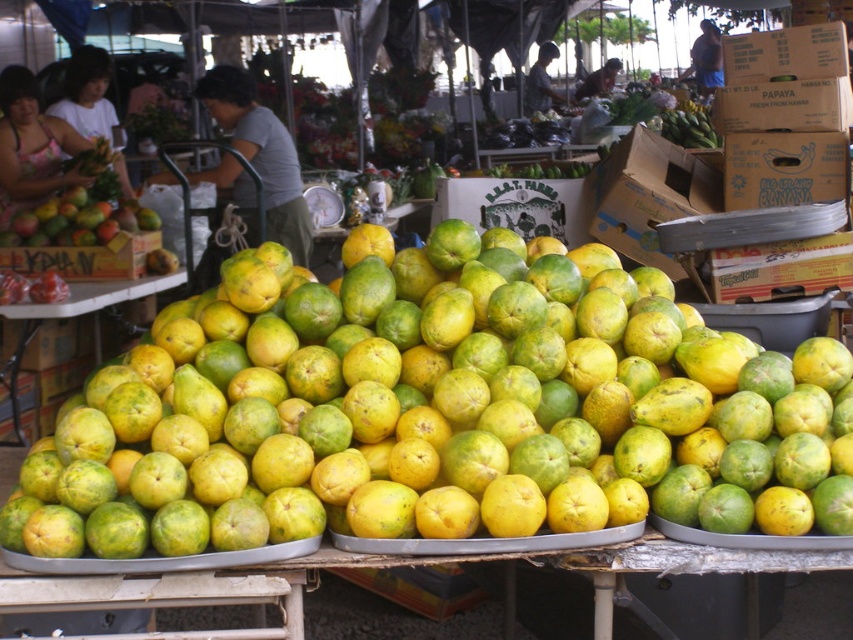
Question: Based on their relative distances, which object is nearer to the wooden crate at center?

Choices:
 (A) green matte papaya at left
 (B) green matte papaya at center

Answer: (A)

Question: Based on their relative distances, which object is nearer to the wooden crate at center?

Choices:
 (A) green matte papaya at left
 (B) green matte papaya at center

Answer: (A)

Question: Considering the real-world distances, which object is farthest from the green matte papaya at left?

Choices:
 (A) green matte papaya at center
 (B) wooden crate at center

Answer: (A)

Question: Is green matte papaya at left to the left of green matte papaya at center from the viewer's perspective?

Choices:
 (A) no
 (B) yes

Answer: (B)

Question: Can you confirm if wooden crate at center is smaller than green matte papaya at center?

Choices:
 (A) yes
 (B) no

Answer: (A)

Question: Can you confirm if green matte papaya at left is positioned below green matte papaya at center?

Choices:
 (A) no
 (B) yes

Answer: (A)